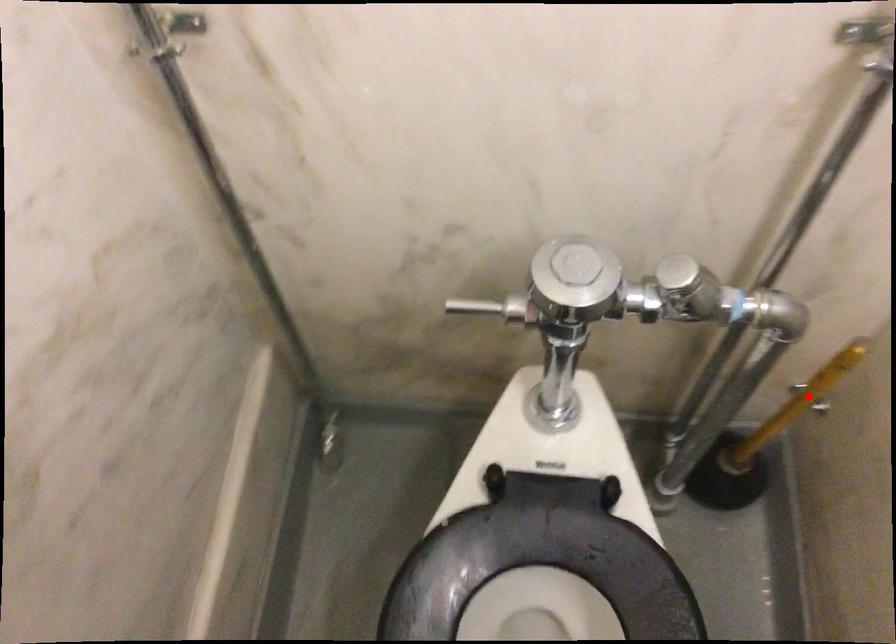
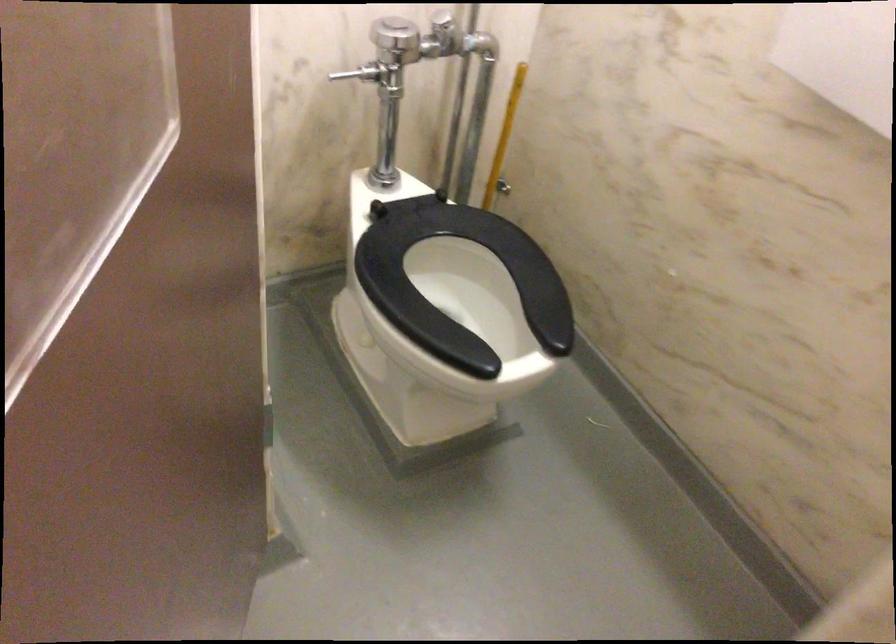
Question: A red point is marked in image1. In image2, is the corresponding 3D point closer to the camera or farther? Reply with the corresponding letter.

Choices:
 (A) The corresponding 3D point is closer.
 (B) The corresponding 3D point is farther.

Answer: (B)